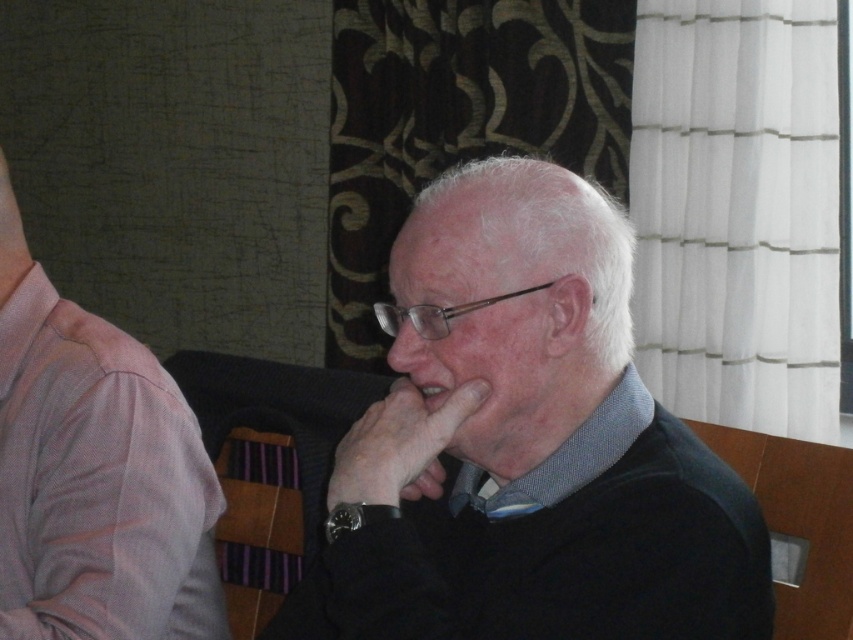
You are an interior designer observing the scene. You need to place a small lamp between the matte black sweater at center and the matte glass nose at center. Based on their positions, which object should the lamp be closer to?

The lamp should be placed closer to the matte glass nose at center because the matte black sweater at center is positioned to its right, meaning the nose is on the left side and the sweater is on the right side. Since the lamp needs to be between them, it should be closer to the nose to maintain symmetry or balance.

You are an interior designer assessing the spatial arrangement of the room. You notice the matte black sweater at center and the matte glass nose at center. Which object is closer to you from your current viewpoint?

The matte black sweater at center is closer to you because it is positioned in front of the matte glass nose at center.